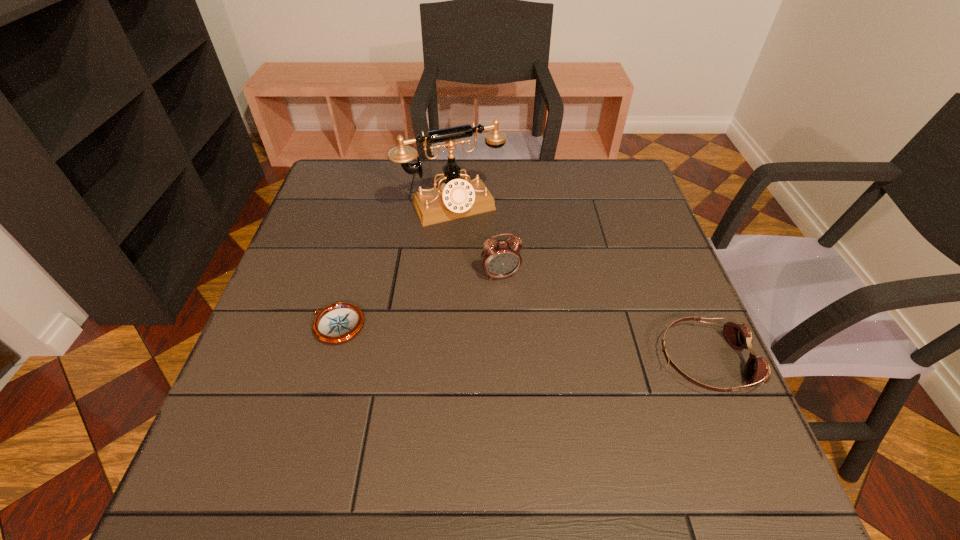
Image resolution: width=960 pixels, height=540 pixels. What are the coordinates of `free spot between the rightmost object and the shortest object` in the screenshot? It's located at (520, 343).

You are a GUI agent. You are given a task and a screenshot of the screen. Output one action in this format:
    pyautogui.click(x=<x>, y=<y>)
    Task: Click on the vacant area between the third shortest object and the telephone
    The image size is (960, 540).
    Given the screenshot: What is the action you would take?
    pyautogui.click(x=476, y=241)

This screenshot has height=540, width=960. What are the coordinates of `vacant area that lies between the third tallest object and the telephone` in the screenshot? It's located at (578, 284).

Identify the location of vacant space that's between the farthest object and the compass. The height and width of the screenshot is (540, 960). (395, 266).

Where is `unoccupied position between the tallest object and the rightmost object`? unoccupied position between the tallest object and the rightmost object is located at coordinates (578, 284).

Locate an element on the screen. free space that is in between the goggles and the telephone is located at coordinates (578, 284).

Image resolution: width=960 pixels, height=540 pixels. Find the location of `object identified as the closest to the shortest object`. object identified as the closest to the shortest object is located at coordinates (500, 258).

You are a GUI agent. You are given a task and a screenshot of the screen. Output one action in this format:
    pyautogui.click(x=<x>, y=<y>)
    Task: Click on the object that is the third closest one to the tallest object
    Image resolution: width=960 pixels, height=540 pixels.
    Given the screenshot: What is the action you would take?
    pyautogui.click(x=739, y=336)

You are a GUI agent. You are given a task and a screenshot of the screen. Output one action in this format:
    pyautogui.click(x=<x>, y=<y>)
    Task: Click on the vacant space that satisfies the following two spatial constraints: 1. on the back side of the compass; 2. on the right side of the second tallest object
    The image size is (960, 540).
    Given the screenshot: What is the action you would take?
    pyautogui.click(x=351, y=275)

Locate an element on the screen. The width and height of the screenshot is (960, 540). free location that satisfies the following two spatial constraints: 1. on the front side of the alarm clock; 2. through the lenses of the third tallest object is located at coordinates (504, 361).